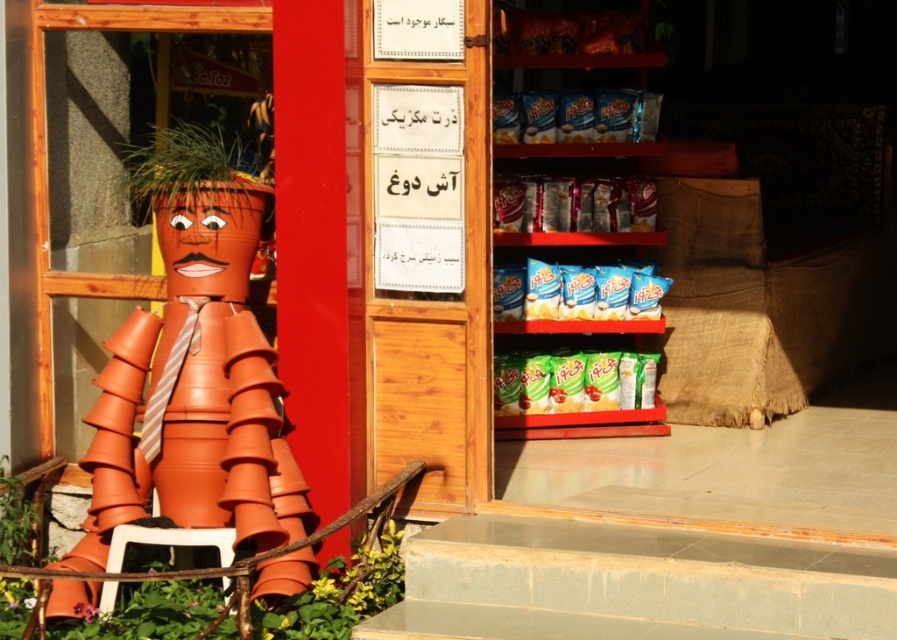
You are a delivery person who needs to place a package between the shiny metallic chips at upper right and the blue glossy chips at upper center. The package is 14 inches long. Can you fit it between them without overlapping either chip?

The distance between the shiny metallic chips at upper right and the blue glossy chips at upper center is 13.67 inches. Since the package is 14 inches long, it is slightly longer than the available space. Therefore, you cannot fit the package between them without overlapping either chip.

You are standing in front of the store entrance and want to determine the relative positions of two points marked in the scene. Which point is closer to you, point (556, 310) or point (606, 109)?

Point (556, 310) is further to the viewer than point (606, 109), so point (606, 109) is closer to you.

Consider the image. You are a customer standing in front of the store entrance. You want to place a new decorative item between the blue glossy chips at upper right and the blue glossy chips at upper center. The item you have is 10 inches long. Do you think it will fit in the space between them?

The blue glossy chips at upper right is 31.91 inches away from blue glossy chips at upper center. Since the space between them is 31.91 inches and the item is only 10 inches long, it will easily fit between them.